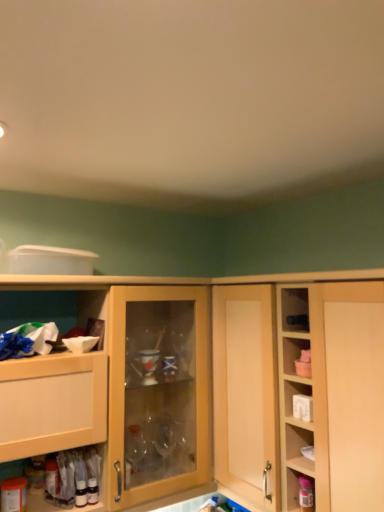
Describe the element at coordinates (298, 400) in the screenshot. Image resolution: width=384 pixels, height=512 pixels. I see `white plastic plug at upper right` at that location.

In order to face white plastic plug at upper right, should I rotate leftwards or rightwards?

To face it directly, rotate right by 15.137 degrees.

In order to face light wood cabinet at left, placed as the 2th cabinetry when sorted from right to left, should I rotate leftwards or rightwards?

Turn left approximately 11.362 degrees to face it.

Describe the element at coordinates (173, 280) in the screenshot. The width and height of the screenshot is (384, 512). I see `light wood cabinet at left, placed as the 2th cabinetry when sorted from right to left` at that location.

In order to face light wood cabinet at center, arranged as the first cabinetry when viewed from the right, should I rotate leftwards or rightwards?

Turn right approximately 16.061 degrees to face it.

Where is `white plastic plug at upper right`? white plastic plug at upper right is located at coordinates (298, 400).

Which of these two, white plastic plug at upper right or light wood cabinet at left, the 1th cabinetry viewed from the left, stands taller?

With more height is light wood cabinet at left, the 1th cabinetry viewed from the left.

Is white plastic plug at upper right inside or outside of light wood cabinet at left, placed as the 2th cabinetry when sorted from right to left?

white plastic plug at upper right lies outside light wood cabinet at left, placed as the 2th cabinetry when sorted from right to left.

Which object is wider, white plastic plug at upper right or light wood cabinet at left, the 1th cabinetry viewed from the left?

With larger width is light wood cabinet at left, the 1th cabinetry viewed from the left.

Is white plastic plug at upper right bigger or smaller than light wood cabinet at left, placed as the 2th cabinetry when sorted from right to left?

white plastic plug at upper right is smaller than light wood cabinet at left, placed as the 2th cabinetry when sorted from right to left.

Is matte plastic container at lower right turned away from white plastic plug at upper right?

That's not correct — matte plastic container at lower right is not looking away from white plastic plug at upper right.

Considering the sizes of objects matte plastic container at lower right and white plastic plug at upper right in the image provided, who is taller, matte plastic container at lower right or white plastic plug at upper right?

With more height is matte plastic container at lower right.

Does matte plastic container at lower right contain white plastic plug at upper right?

No, white plastic plug at upper right is not a part of matte plastic container at lower right.

Consider the image. Can you tell me how much matte plastic container at lower right and white plastic plug at upper right differ in facing direction?

There is a 0.00728-degree angle between the facing directions of matte plastic container at lower right and white plastic plug at upper right.

Do you think light wood cabinet at center, which is the 2th cabinetry in left-to-right order, is within matte plastic container at lower right, or outside of it?

light wood cabinet at center, which is the 2th cabinetry in left-to-right order, is not inside matte plastic container at lower right, it's outside.

You are a GUI agent. You are given a task and a screenshot of the screen. Output one action in this format:
    pyautogui.click(x=<x>, y=<y>)
    Task: Click on the cabinet below the light wood cabinet at center, arranged as the first cabinetry when viewed from the right (from a real-world perspective)
    This screenshot has width=384, height=512.
    Given the screenshot: What is the action you would take?
    pyautogui.click(x=300, y=490)

Which is closer, (239, 458) or (301, 487)?

Point (301, 487)

Does light wood cabinet at center, which is the 2th cabinetry in left-to-right order, appear on the left side of matte plastic container at lower right?

No, light wood cabinet at center, which is the 2th cabinetry in left-to-right order, is not to the left of matte plastic container at lower right.

Choose the correct answer: Is matte plastic container at lower right inside light wood cabinet at left, placed as the 2th cabinetry when sorted from right to left, or outside it?

matte plastic container at lower right is outside light wood cabinet at left, placed as the 2th cabinetry when sorted from right to left.

From a real-world perspective, does matte plastic container at lower right stand above light wood cabinet at left, the 1th cabinetry viewed from the left?

Incorrect, from a real-world perspective, matte plastic container at lower right is lower than light wood cabinet at left, the 1th cabinetry viewed from the left.

Where is `cabinet directly beneath the light wood cabinet at left, the 1th cabinetry viewed from the left (from a real-world perspective)`? This screenshot has width=384, height=512. cabinet directly beneath the light wood cabinet at left, the 1th cabinetry viewed from the left (from a real-world perspective) is located at coordinates [x=300, y=490].

Is matte plastic container at lower right touching light wood cabinet at left, the 1th cabinetry viewed from the left?

matte plastic container at lower right is not next to light wood cabinet at left, the 1th cabinetry viewed from the left, and they're not touching.

Would you say light wood cabinet at center, which is the 2th cabinetry in left-to-right order, is to the left or to the right of light wood cabinet at left, the 1th cabinetry viewed from the left, in the picture?

light wood cabinet at center, which is the 2th cabinetry in left-to-right order, is to the right of light wood cabinet at left, the 1th cabinetry viewed from the left.

Are light wood cabinet at center, arranged as the first cabinetry when viewed from the right, and light wood cabinet at left, placed as the 2th cabinetry when sorted from right to left, far apart?

light wood cabinet at center, arranged as the first cabinetry when viewed from the right, is near light wood cabinet at left, placed as the 2th cabinetry when sorted from right to left, not far away.

Is light wood cabinet at center, which is the 2th cabinetry in left-to-right order, not within light wood cabinet at left, placed as the 2th cabinetry when sorted from right to left?

Yes, light wood cabinet at center, which is the 2th cabinetry in left-to-right order, is not within light wood cabinet at left, placed as the 2th cabinetry when sorted from right to left.

Can you confirm if light wood cabinet at center, which is the 2th cabinetry in left-to-right order, is smaller than light wood cabinet at left, the 1th cabinetry viewed from the left?

Indeed, light wood cabinet at center, which is the 2th cabinetry in left-to-right order, has a smaller size compared to light wood cabinet at left, the 1th cabinetry viewed from the left.

Is point (238, 406) positioned behind point (298, 416)?

Yes.

Can you confirm if light wood cabinet at center, which is the 2th cabinetry in left-to-right order, is bigger than white plastic plug at upper right?

Indeed, light wood cabinet at center, which is the 2th cabinetry in left-to-right order, has a larger size compared to white plastic plug at upper right.

Is light wood cabinet at center, which is the 2th cabinetry in left-to-right order, to the left of white plastic plug at upper right from the viewer's perspective?

Incorrect, light wood cabinet at center, which is the 2th cabinetry in left-to-right order, is not on the left side of white plastic plug at upper right.

Who is taller, light wood cabinet at center, which is the 2th cabinetry in left-to-right order, or white plastic plug at upper right?

light wood cabinet at center, which is the 2th cabinetry in left-to-right order, is taller.

Can you confirm if matte plastic container at lower right is positioned to the right of light wood cabinet at center, which is the 2th cabinetry in left-to-right order?

Incorrect, matte plastic container at lower right is not on the right side of light wood cabinet at center, which is the 2th cabinetry in left-to-right order.

Is the surface of matte plastic container at lower right in direct contact with light wood cabinet at center, which is the 2th cabinetry in left-to-right order?

There is a gap between matte plastic container at lower right and light wood cabinet at center, which is the 2th cabinetry in left-to-right order.

In the image, is matte plastic container at lower right positioned in front of or behind light wood cabinet at center, arranged as the first cabinetry when viewed from the right?

A: matte plastic container at lower right is positioned farther from the viewer than light wood cabinet at center, arranged as the first cabinetry when viewed from the right.

In order to click on shelf to the right of light wood cabinet at left, the 1th cabinetry viewed from the left in this screenshot , I will do `click(298, 400)`.

The image size is (384, 512). In order to click on cabinet located in front of the white plastic plug at upper right in this screenshot , I will do `click(300, 490)`.

From the image, which object appears to be nearer to light wood cabinet at center, which is the 2th cabinetry in left-to-right order, matte plastic container at lower right or white plastic plug at upper right?

white plastic plug at upper right lies closer to light wood cabinet at center, which is the 2th cabinetry in left-to-right order, than the other object.

When comparing their distances from light wood cabinet at left, the 1th cabinetry viewed from the left, does white plastic plug at upper right or light wood cabinet at center, which is the 2th cabinetry in left-to-right order, seem further?

white plastic plug at upper right.

Which object lies nearer to the anchor point light wood cabinet at left, the 1th cabinetry viewed from the left, light wood cabinet at center, which is the 2th cabinetry in left-to-right order, or matte plastic container at lower right?

light wood cabinet at center, which is the 2th cabinetry in left-to-right order, is closer to light wood cabinet at left, the 1th cabinetry viewed from the left.

From the image, which object appears to be farther from matte plastic container at lower right, light wood cabinet at left, placed as the 2th cabinetry when sorted from right to left, or white plastic plug at upper right?

light wood cabinet at left, placed as the 2th cabinetry when sorted from right to left, is positioned further to the anchor matte plastic container at lower right.

From the image, which object appears to be nearer to light wood cabinet at center, arranged as the first cabinetry when viewed from the right, white plastic plug at upper right or matte plastic container at lower right?

Based on the image, white plastic plug at upper right appears to be nearer to light wood cabinet at center, arranged as the first cabinetry when viewed from the right.

Considering their positions, is white plastic plug at upper right positioned closer to light wood cabinet at left, the 1th cabinetry viewed from the left, than matte plastic container at lower right?

white plastic plug at upper right is positioned closer to the anchor light wood cabinet at left, the 1th cabinetry viewed from the left.

Based on their spatial positions, is light wood cabinet at left, the 1th cabinetry viewed from the left, or white plastic plug at upper right closer to light wood cabinet at center, arranged as the first cabinetry when viewed from the right?

The object closer to light wood cabinet at center, arranged as the first cabinetry when viewed from the right, is white plastic plug at upper right.

In the scene shown: When comparing their distances from light wood cabinet at center, arranged as the first cabinetry when viewed from the right, does white plastic plug at upper right or light wood cabinet at left, placed as the 2th cabinetry when sorted from right to left, seem closer?

white plastic plug at upper right is closer to light wood cabinet at center, arranged as the first cabinetry when viewed from the right.

The width and height of the screenshot is (384, 512). In order to click on shelf between light wood cabinet at left, the 1th cabinetry viewed from the left, and light wood cabinet at center, which is the 2th cabinetry in left-to-right order, from left to right in this screenshot , I will do `click(298, 400)`.

Identify the location of cabinet situated between light wood cabinet at left, placed as the 2th cabinetry when sorted from right to left, and light wood cabinet at center, which is the 2th cabinetry in left-to-right order, from left to right. This screenshot has height=512, width=384. (300, 490).

This screenshot has width=384, height=512. What are the coordinates of `cabinet between light wood cabinet at left, the 1th cabinetry viewed from the left, and white plastic plug at upper right from left to right` in the screenshot? It's located at (300, 490).

Find the location of a particular element. cabinet located between light wood cabinet at center, which is the 2th cabinetry in left-to-right order, and white plastic plug at upper right in the depth direction is located at coordinates 300,490.